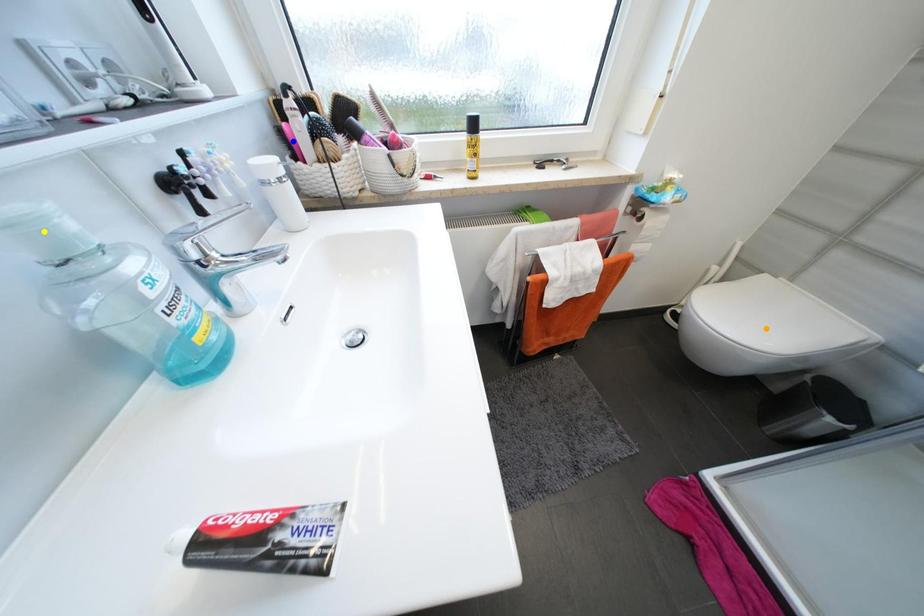
Order these from nearest to farthest:
blue point
orange point
yellow point

yellow point, blue point, orange point